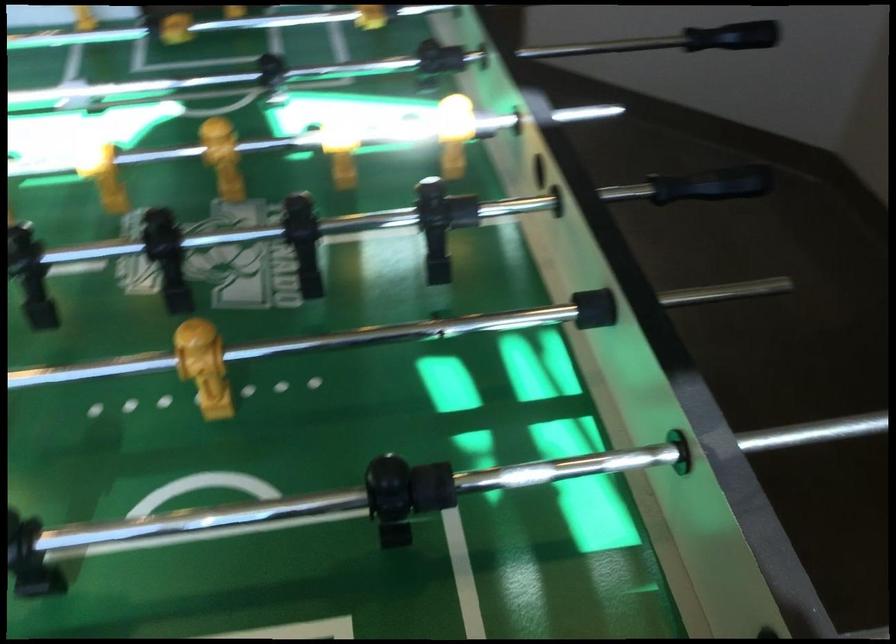
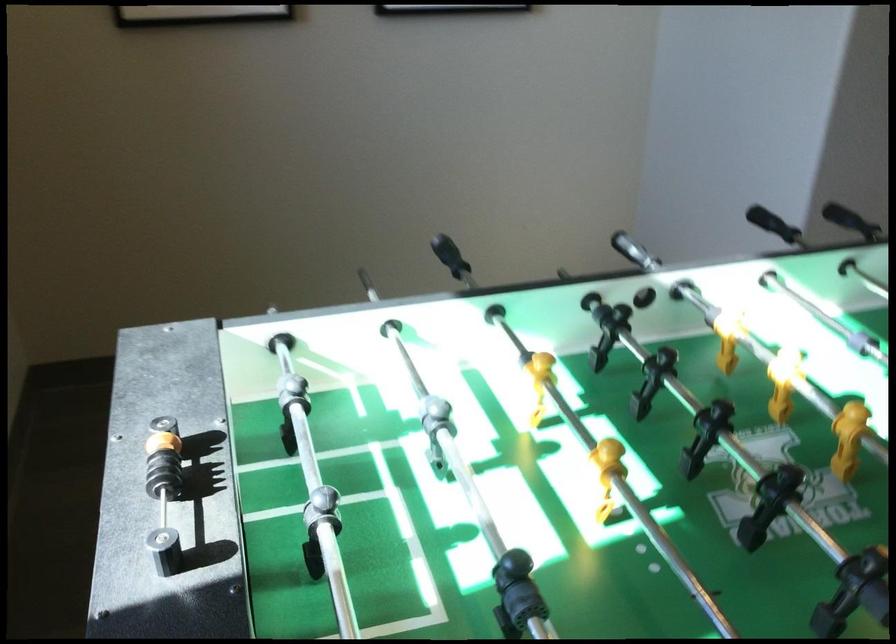
Question: The first image is from the beginning of the video and the second image is from the end. How did the camera likely rotate when shooting the video?

Choices:
 (A) Left
 (B) Right
 (C) Up
 (D) Down

Answer: (A)